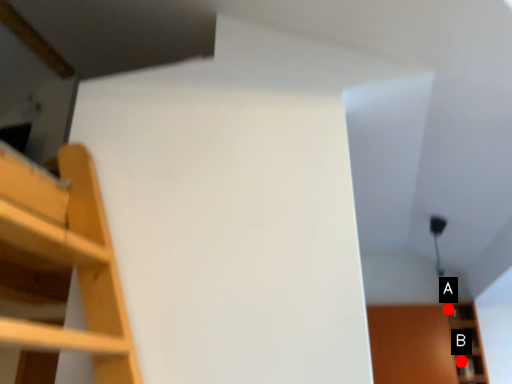
Question: Two points are circled on the image, labeled by A and B beside each circle. Which point is further to the camera?

Choices:
 (A) A is further
 (B) B is further

Answer: (A)